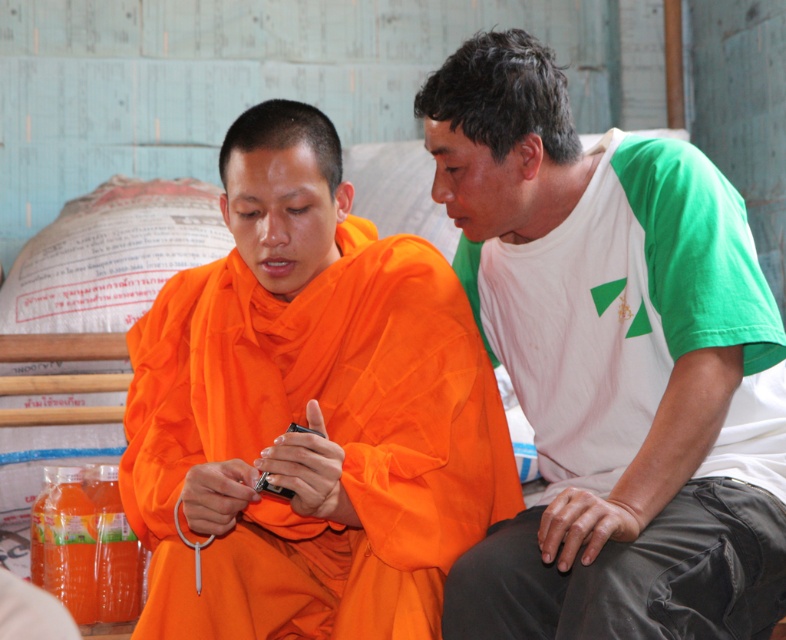
You are standing in the room and want to place a small plant between the two points, point (535, 349) and point (244, 506). Which point should the plant be closer to in order to be closer to the viewer?

The plant should be closer to point (535, 349) because it is further to the viewer than point (244, 506).